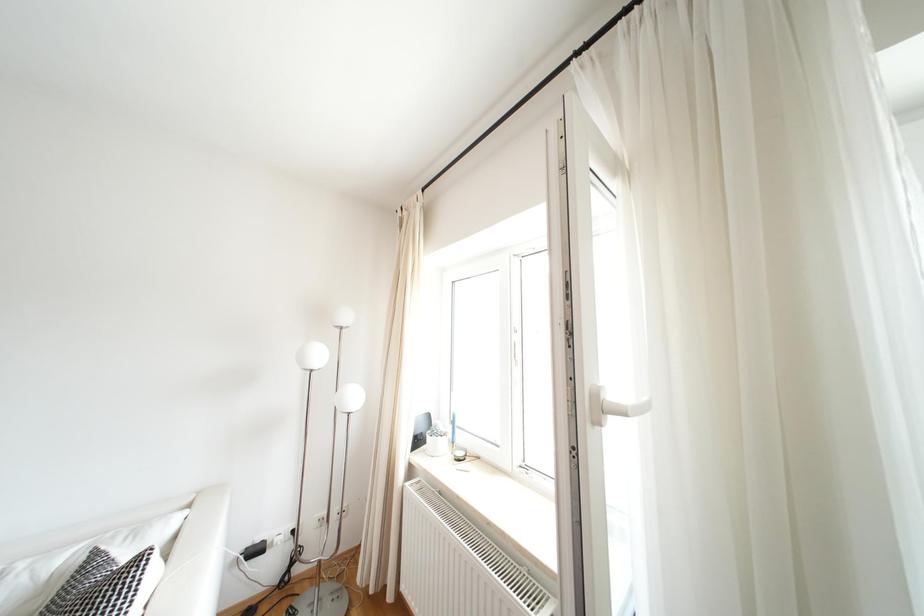
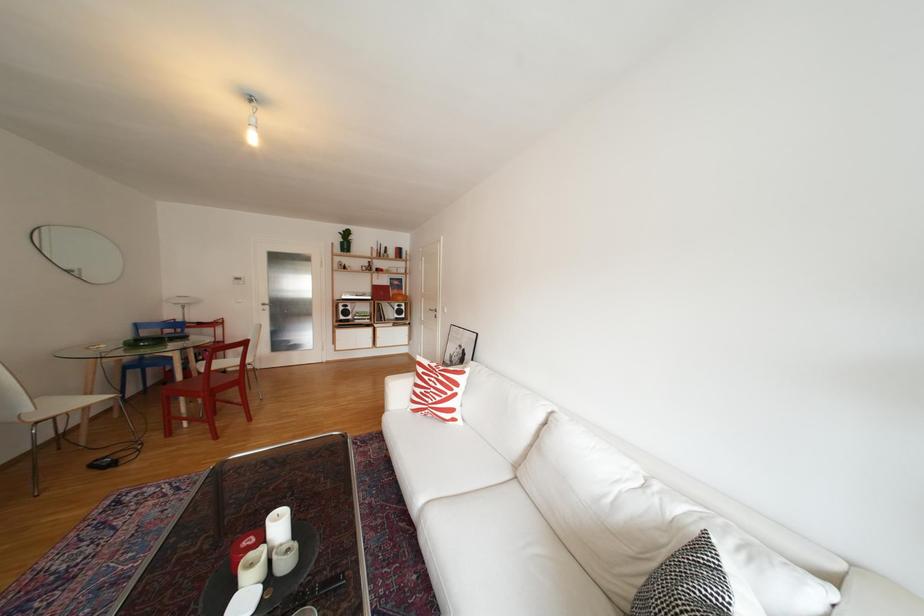
Question: The images are taken continuously from a first-person perspective. In which direction is your viewpoint rotating?

Choices:
 (A) Left
 (B) Right
 (C) Up
 (D) Down

Answer: (A)